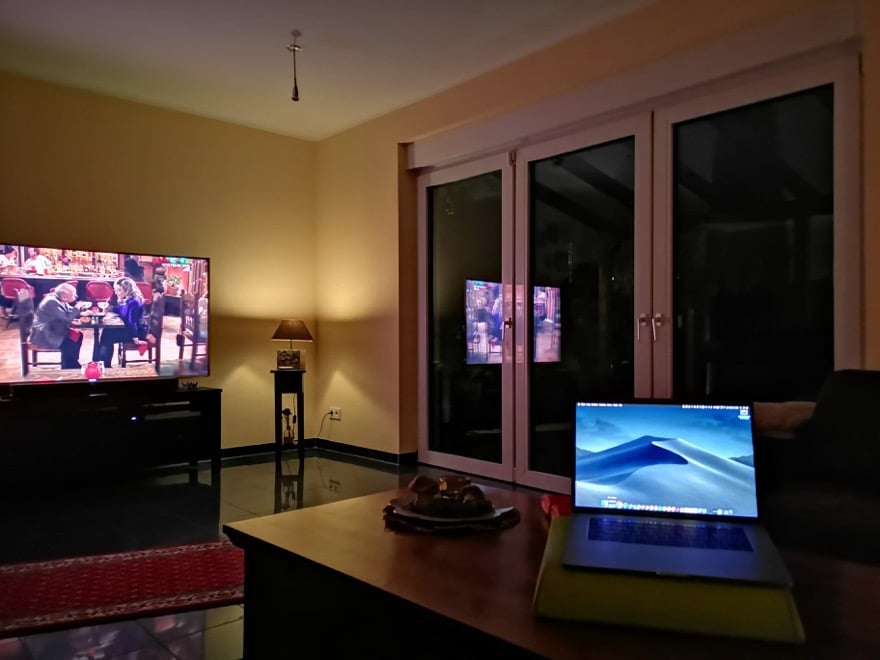
At what (x,y) coordinates should I click in order to perform the action: click on light. Please return your answer as a coordinate pair (x, y). The width and height of the screenshot is (880, 660). Looking at the image, I should click on (326, 302).